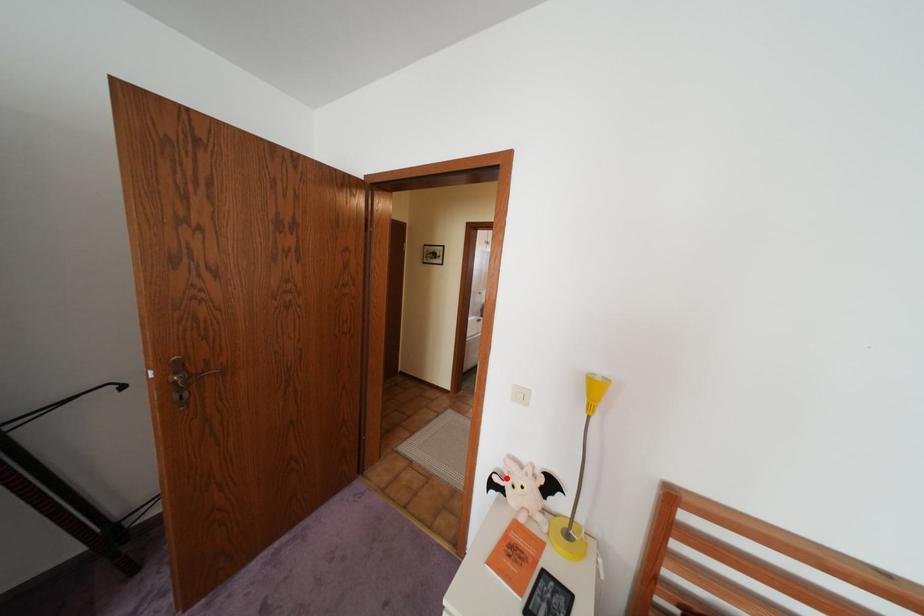
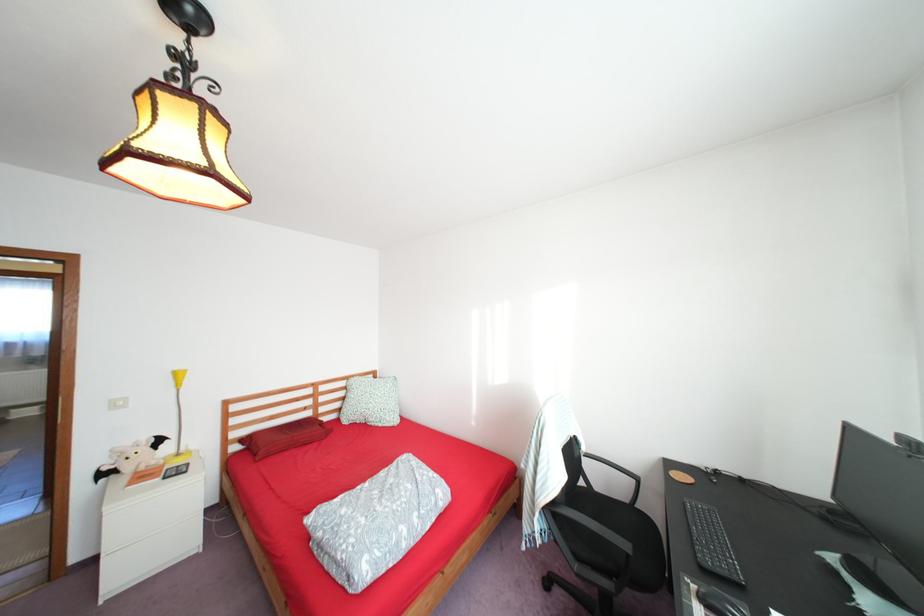
Locate, in the second image, the point that corresponds to the highlighted location in the first image.

(116, 468)